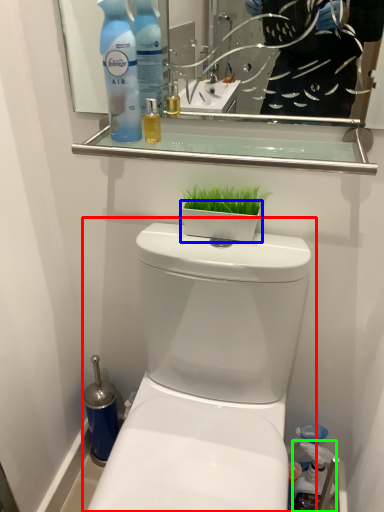
Question: Which object is positioned farthest from toilet (highlighted by a red box)? Select from flowerpot (highlighted by a blue box) and cleaning product (highlighted by a green box).

Choices:
 (A) flowerpot
 (B) cleaning product

Answer: (B)